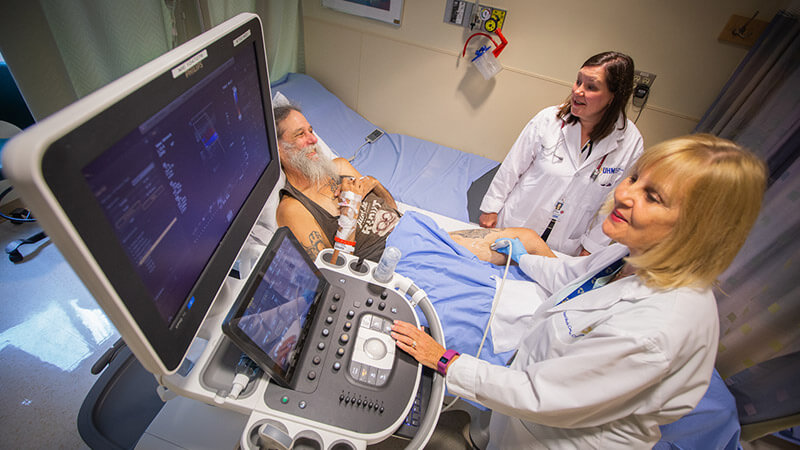
What are the coordinates of `wall` in the screenshot? It's located at (546, 33), (492, 118).